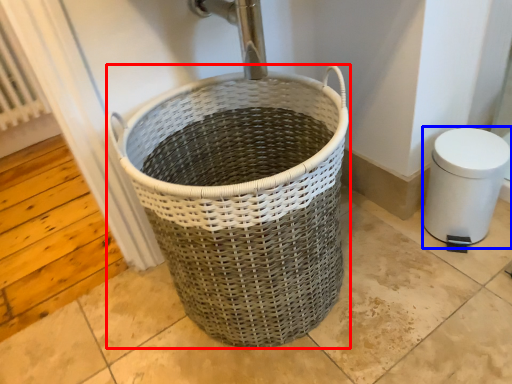
Question: Among these objects, which one is farthest to the camera, waste container (highlighted by a red box) or bidet (highlighted by a blue box)?

Choices:
 (A) waste container
 (B) bidet

Answer: (B)